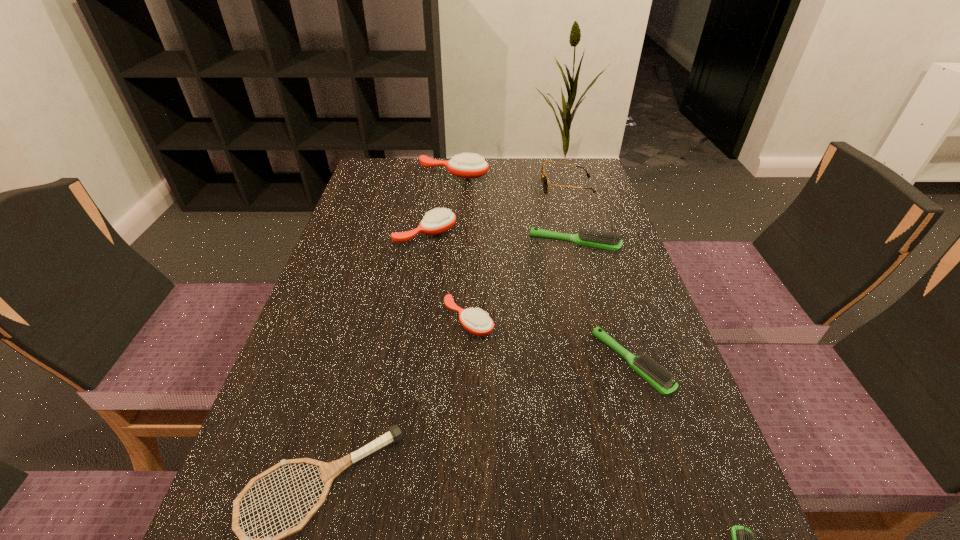
Identify the location of sunglasses at the right edge. (543, 177).

Where is `object that is at the far right corner`? This screenshot has height=540, width=960. object that is at the far right corner is located at coordinates coord(543,177).

You are a GUI agent. You are given a task and a screenshot of the screen. Output one action in this format:
    pyautogui.click(x=<x>, y=<y>)
    Task: Click on the vacant space at the far edge of the desktop
    
    Given the screenshot: What is the action you would take?
    pyautogui.click(x=523, y=185)

Identify the location of free space at the left edge. (408, 202).

Locate an element on the screen. This screenshot has width=960, height=540. blank space at the right edge of the desktop is located at coordinates (609, 359).

Image resolution: width=960 pixels, height=540 pixels. Find the location of `free space at the far left corner of the desktop`. free space at the far left corner of the desktop is located at coordinates (386, 187).

Locate an element on the screen. This screenshot has height=540, width=960. vacant space at the far right corner of the desktop is located at coordinates (602, 183).

Identify the location of free space between the farthest orange hairbrush and the nearest orange hairbrush. (461, 247).

Locate an element on the screen. This screenshot has width=960, height=540. free space between the second farthest light hairbrush and the second smallest orange hairbrush is located at coordinates (528, 299).

Image resolution: width=960 pixels, height=540 pixels. I want to click on vacant point located between the biggest light hairbrush and the second biggest orange hairbrush, so click(x=500, y=239).